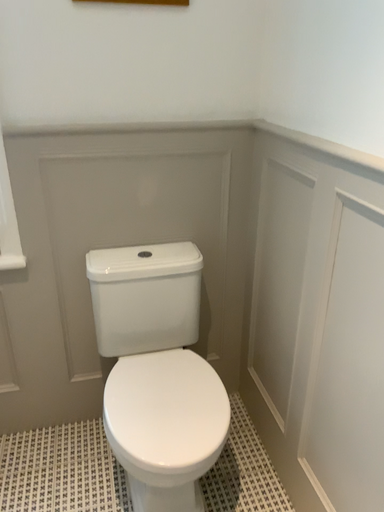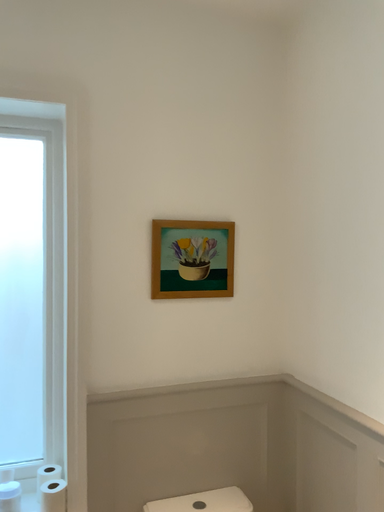
Question: Which way did the camera rotate in the video?

Choices:
 (A) rotated downward
 (B) rotated upward

Answer: (B)